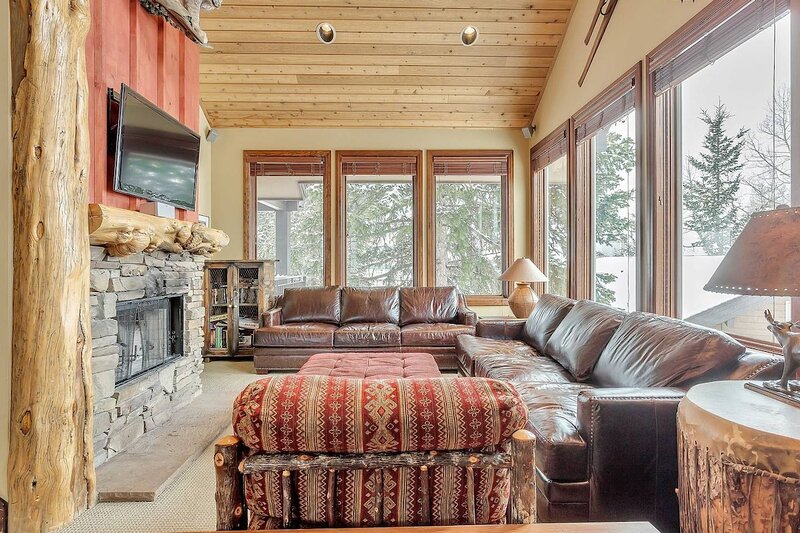
I want to click on couch, so click(641, 356).